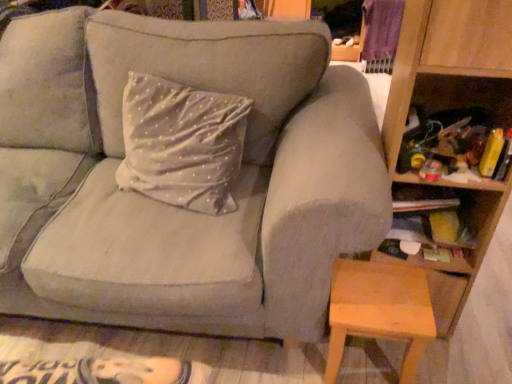
Question: Based on their sizes in the image, would you say wooden stool at lower right is bigger or smaller than suede gray couch at center?

Choices:
 (A) big
 (B) small

Answer: (B)

Question: Is wooden stool at lower right wider or thinner than suede gray couch at center?

Choices:
 (A) thin
 (B) wide

Answer: (A)

Question: Based on their relative distances, which object is nearer to the wooden bookshelf at right?

Choices:
 (A) suede gray couch at center
 (B) wooden stool at lower right

Answer: (B)

Question: Considering the real-world distances, which object is closest to the suede gray couch at center?

Choices:
 (A) wooden stool at lower right
 (B) wooden bookshelf at right

Answer: (A)